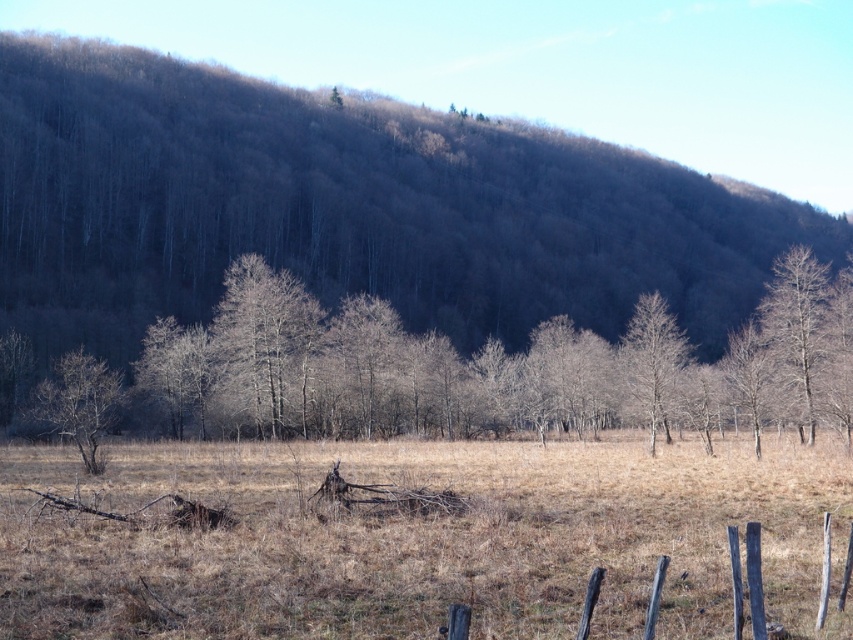
You are standing in the open field and see the bare wood tree at right and the bare wood tree at left. Which tree is positioned to the right side of the other?

The bare wood tree at right is to the right of the bare wood tree at left.